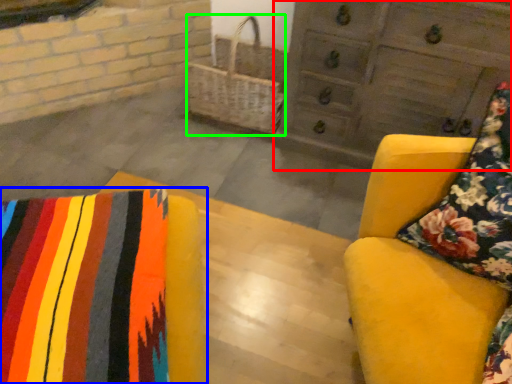
Question: Considering the real-world distances, which object is farthest from chest of drawers (highlighted by a red box)? furniture (highlighted by a blue box) or basket (highlighted by a green box)?

Choices:
 (A) furniture
 (B) basket

Answer: (A)